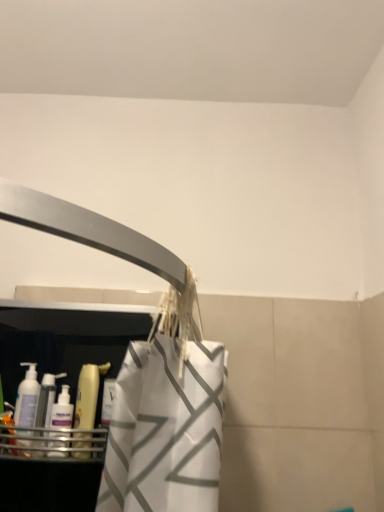
Question: In terms of size, does translucent plastic bottle at left, which ranks as the second cleaning product in left-to-right order, appear bigger or smaller than translucent plastic bottle at left, which is counted as the 1th cleaning product, starting from the left?

Choices:
 (A) small
 (B) big

Answer: (B)

Question: From a real-world perspective, is translucent plastic bottle at left, which ranks as the second cleaning product in left-to-right order, above or below translucent plastic bottle at left, arranged as the second cleaning product when viewed from the right?

Choices:
 (A) above
 (B) below

Answer: (A)

Question: In terms of width, does translucent plastic bottle at left, the first cleaning product positioned from the right, look wider or thinner when compared to translucent plastic bottle at left, which is counted as the 1th cleaning product, starting from the left?

Choices:
 (A) wide
 (B) thin

Answer: (B)

Question: In the image, is translucent plastic bottle at left, which is counted as the 1th cleaning product, starting from the left, positioned in front of or behind translucent plastic bottle at left, which ranks as the second cleaning product in left-to-right order?

Choices:
 (A) front
 (B) behind

Answer: (A)

Question: From a real-world perspective, is translucent plastic bottle at left, arranged as the second cleaning product when viewed from the right, positioned above or below translucent plastic bottle at left, the first cleaning product positioned from the right?

Choices:
 (A) above
 (B) below

Answer: (B)

Question: Considering the positions of translucent plastic bottle at left, arranged as the second cleaning product when viewed from the right, and translucent plastic bottle at left, the first cleaning product positioned from the right, in the image, is translucent plastic bottle at left, arranged as the second cleaning product when viewed from the right, taller or shorter than translucent plastic bottle at left, the first cleaning product positioned from the right,?

Choices:
 (A) tall
 (B) short

Answer: (B)

Question: Visually, is translucent plastic bottle at left, arranged as the second cleaning product when viewed from the right, positioned to the left or to the right of translucent plastic bottle at left, which ranks as the second cleaning product in left-to-right order?

Choices:
 (A) right
 (B) left

Answer: (B)